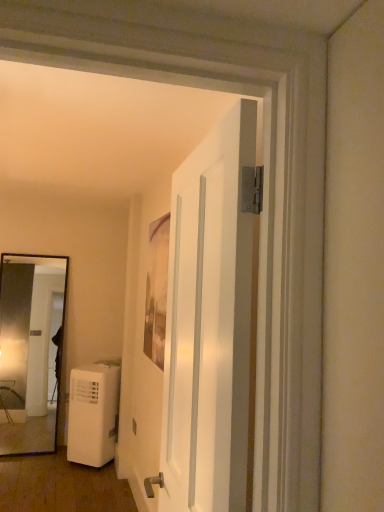
Identify the location of vacant area that is in front of white plastic air conditioner at lower left. Image resolution: width=384 pixels, height=512 pixels. (73, 478).